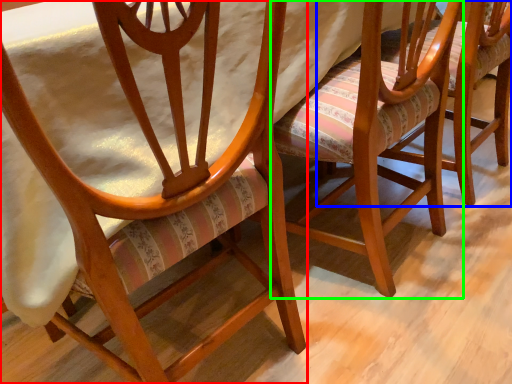
Question: Which object is the closest to the chair (highlighted by a red box)? Choose among these: chair (highlighted by a blue box) or chair (highlighted by a green box).

Choices:
 (A) chair
 (B) chair

Answer: (B)